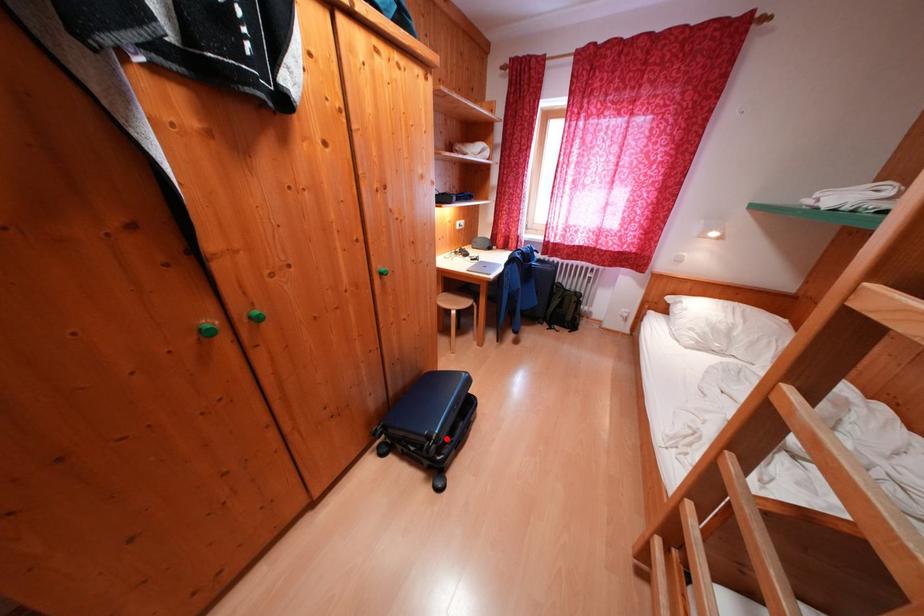
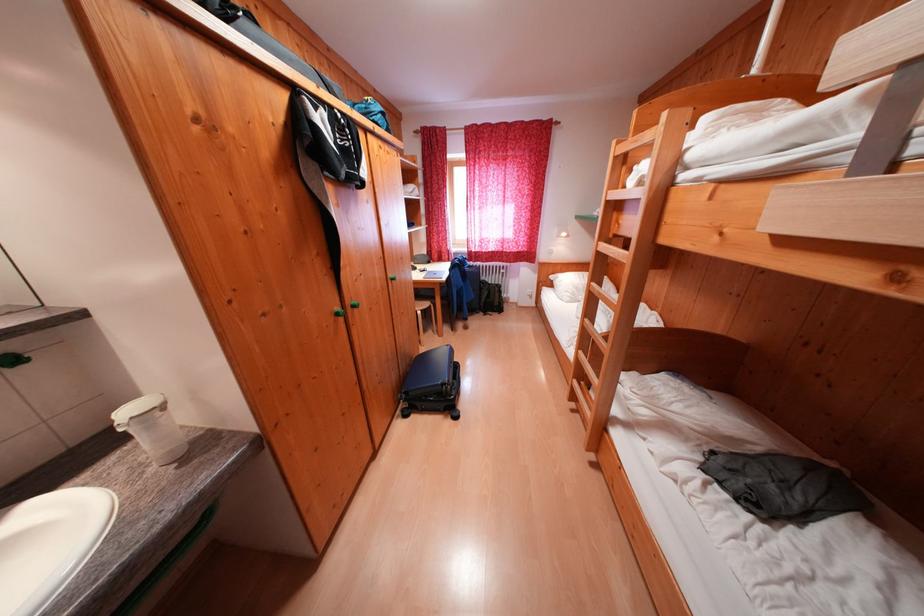
Where in the second image is the point corresponding to the highlighted location from the first image?

(456, 384)